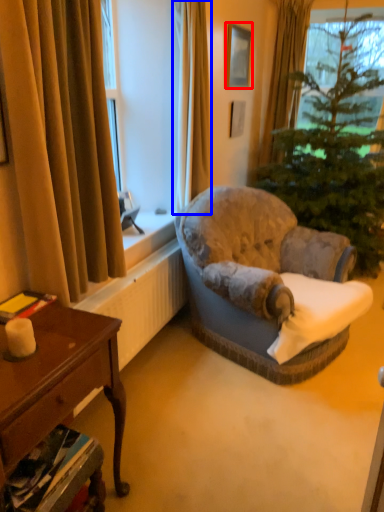
Question: Among these objects, which one is nearest to the camera, picture frame (highlighted by a red box) or curtain (highlighted by a blue box)?

Choices:
 (A) picture frame
 (B) curtain

Answer: (B)